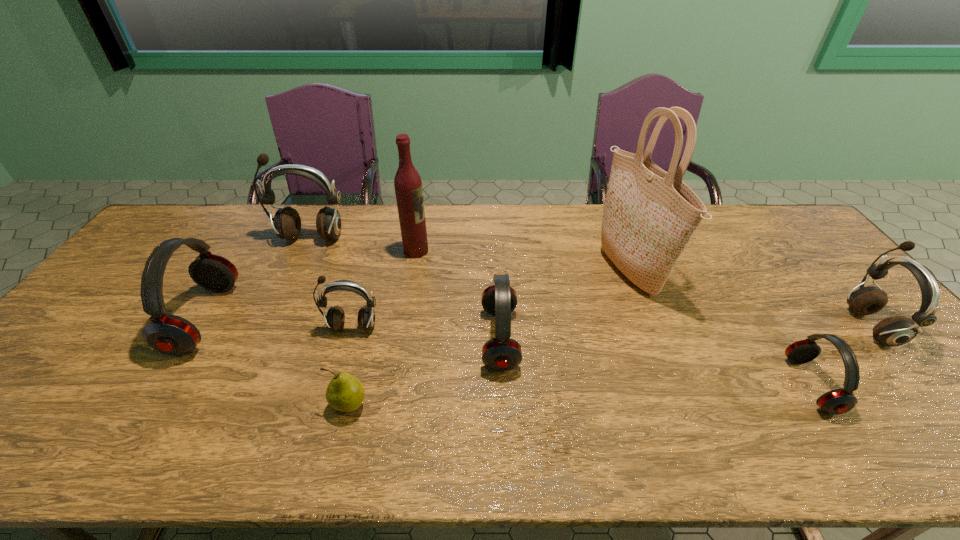
At what (x,y) coordinates should I click in order to perform the action: click on object identified as the third closest to the rightmost earphone. Please return your answer as a coordinate pair (x, y). The image size is (960, 540). Looking at the image, I should click on (502, 353).

This screenshot has width=960, height=540. I want to click on earphone that is the second closest to the shortest earphone, so click(502, 353).

Where is `the fourth closest earphone relative to the eighth shortest object`? The image size is (960, 540). the fourth closest earphone relative to the eighth shortest object is located at coordinates (169, 334).

The height and width of the screenshot is (540, 960). I want to click on brown earphone that stands as the second closest to the leftmost brown earphone, so click(x=893, y=331).

This screenshot has height=540, width=960. I want to click on brown earphone identified as the second closest to the third object from right to left, so click(335, 318).

Locate which red earphone is the closest to the second red earphone from left to right. Please provide its 2D coordinates. Your answer should be formatted as a tuple, i.e. [(x, y)], where the tuple contains the x and y coordinates of a point satisfying the conditions above.

[(838, 401)]

Where is `the second closest red earphone to the shopping bag`? the second closest red earphone to the shopping bag is located at coordinates [502, 353].

Find the location of a particular element. The height and width of the screenshot is (540, 960). vacant region that satisfies the following two spatial constraints: 1. on the label of the fifth object from right to left; 2. on the left side of the seventh object from left to right is located at coordinates (413, 272).